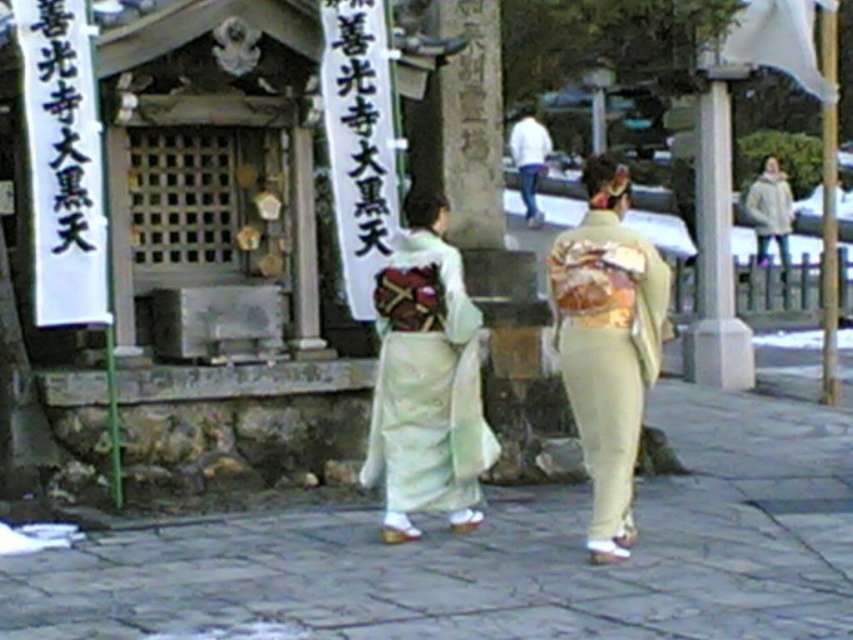
Is light gray stone pavement at center bigger than white silk kimono at center?

No, light gray stone pavement at center is not bigger than white silk kimono at center.

The width and height of the screenshot is (853, 640). I want to click on light gray stone pavement at center, so click(498, 554).

Where is `light gray stone pavement at center`? The height and width of the screenshot is (640, 853). light gray stone pavement at center is located at coordinates (498, 554).

Between light gray stone pavement at center and white cotton jacket at upper right, which one has less height?

With less height is light gray stone pavement at center.

Is light gray stone pavement at center thinner than white cotton jacket at upper right?

Yes, light gray stone pavement at center is thinner than white cotton jacket at upper right.

Who is more distant from viewer, (840, 420) or (750, 202)?

Point (750, 202)

Image resolution: width=853 pixels, height=640 pixels. I want to click on light gray stone pavement at center, so click(x=498, y=554).

Which of these two, light beige kimono at center or white cotton jacket at upper right, stands shorter?

white cotton jacket at upper right is shorter.

Between point (614, 248) and point (756, 248), which one is positioned behind?

Positioned behind is point (756, 248).

Between point (618, 449) and point (761, 234), which one is positioned behind?

The point (761, 234) is behind.

The image size is (853, 640). Identify the location of light beige kimono at center. (607, 344).